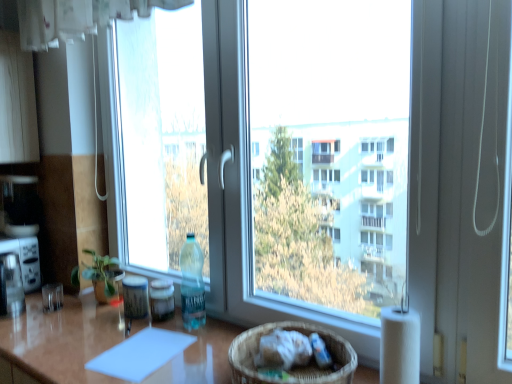
Locate an element on the screen. The height and width of the screenshot is (384, 512). free point in front of green matte plant at left is located at coordinates (70, 323).